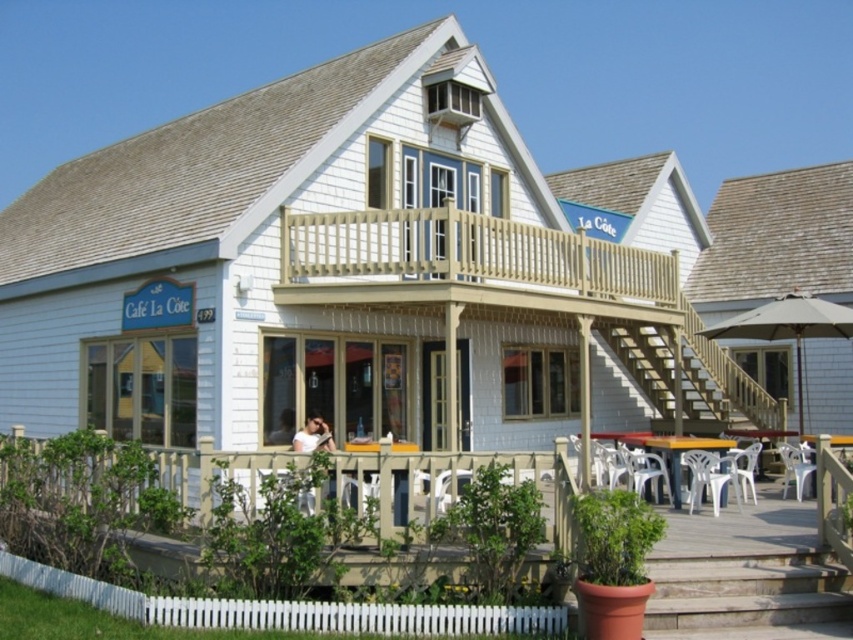
Is wooden stairs at center to the right of white fabric shirt at lower center from the viewer's perspective?

Yes, wooden stairs at center is to the right of white fabric shirt at lower center.

The width and height of the screenshot is (853, 640). What do you see at coordinates (646, 360) in the screenshot? I see `wooden stairs at center` at bounding box center [646, 360].

Measure the distance between wooden stairs at center and camera.

wooden stairs at center is 33.71 meters away from camera.

Where is `wooden stairs at center`? wooden stairs at center is located at coordinates (646, 360).

Who is positioned more to the left, wooden stairs at center or smooth skin face at center?

From the viewer's perspective, smooth skin face at center appears more on the left side.

Does wooden stairs at center have a larger size compared to smooth skin face at center?

Yes.

What do you see at coordinates (646, 360) in the screenshot?
I see `wooden stairs at center` at bounding box center [646, 360].

The width and height of the screenshot is (853, 640). I want to click on wooden stairs at center, so click(646, 360).

Can you confirm if white fabric shirt at lower center is positioned to the right of smooth skin face at center?

Indeed, white fabric shirt at lower center is positioned on the right side of smooth skin face at center.

Which of these two, white fabric shirt at lower center or smooth skin face at center, stands shorter?

white fabric shirt at lower center

Is point (312, 448) behind point (281, 429)?

No, (312, 448) is closer to viewer.

I want to click on white fabric shirt at lower center, so click(312, 435).